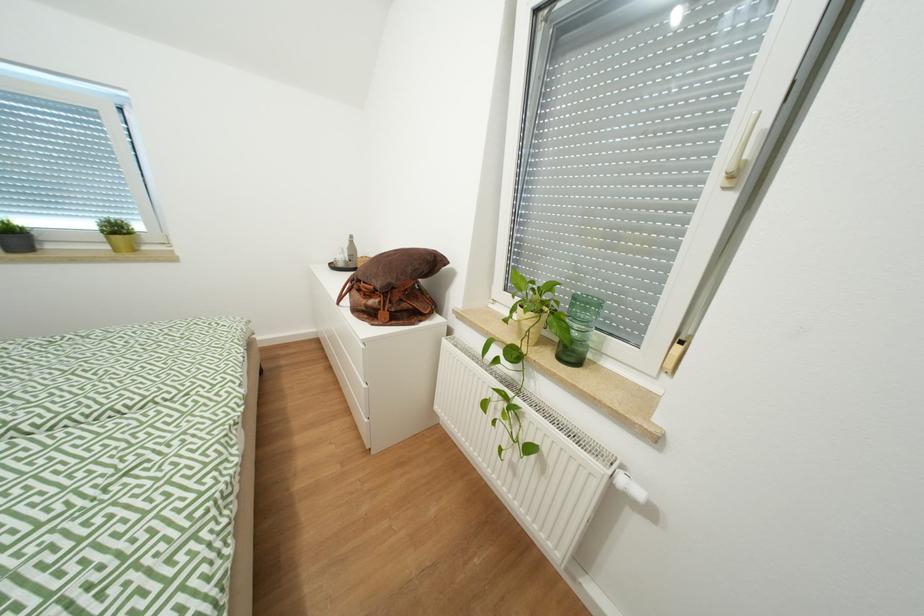
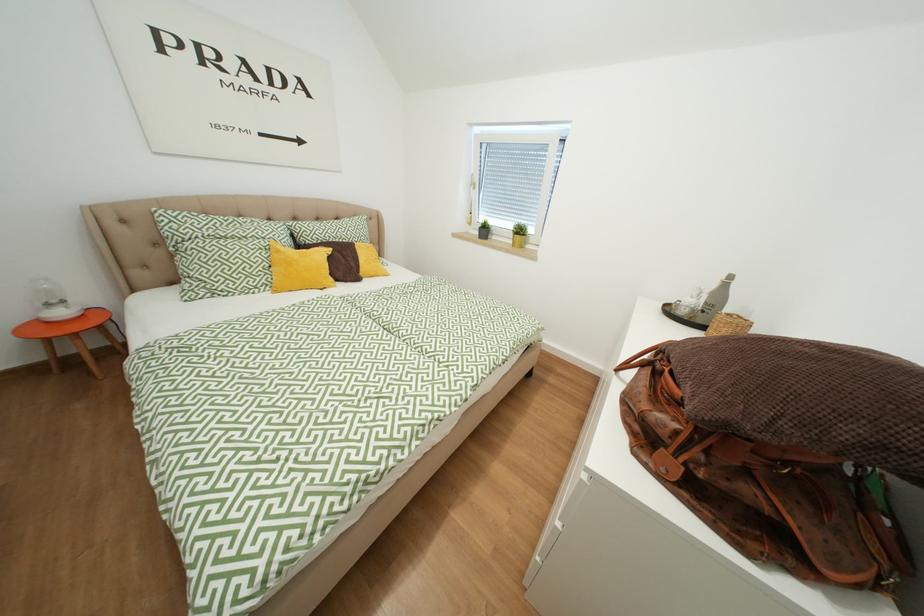
Question: The camera is either moving clockwise (left) or counter-clockwise (right) around the object. The first image is from the beginning of the video and the second image is from the end. Is the camera moving left or right when shooting the video?

Choices:
 (A) Left
 (B) Right

Answer: (B)